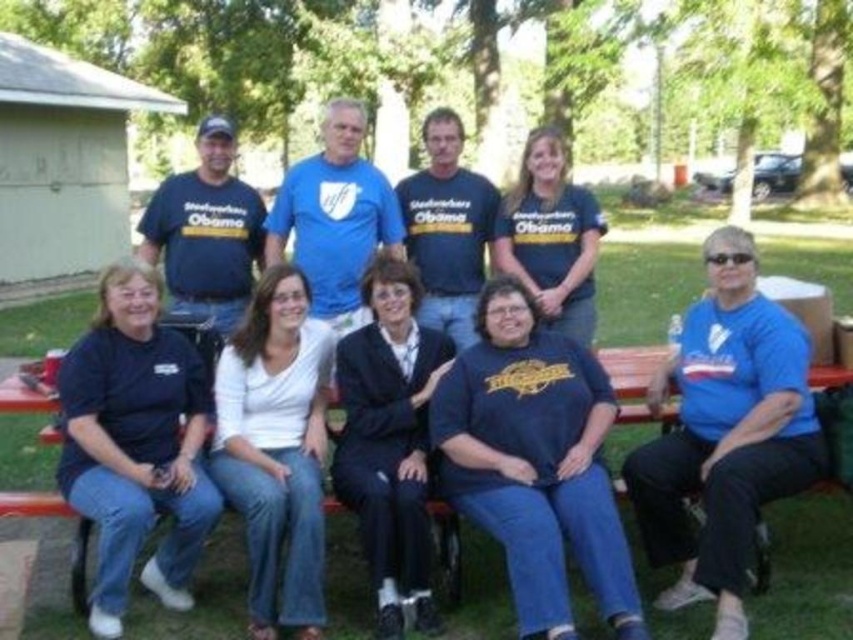
You are a photographer setting up for a group photo. You have a navy blue suit at center and a wooden park bench at lower center in your frame. Which object should you adjust your camera angle to focus on first if you want to ensure both are in focus?

The navy blue suit at center is much taller than the wooden park bench at lower center, so you should focus on the navy blue suit at center first to ensure depth of field covers both objects.

You are a photographer who needs to adjust the height of your camera to capture both the dark blue jersey at center and the matte black shirt at lower left in the same frame. Which object should you focus on first to ensure both are in the frame?

The dark blue jersey at center is shorter than the matte black shirt at lower left, so you should focus on the dark blue jersey at center first to ensure both are in the frame.